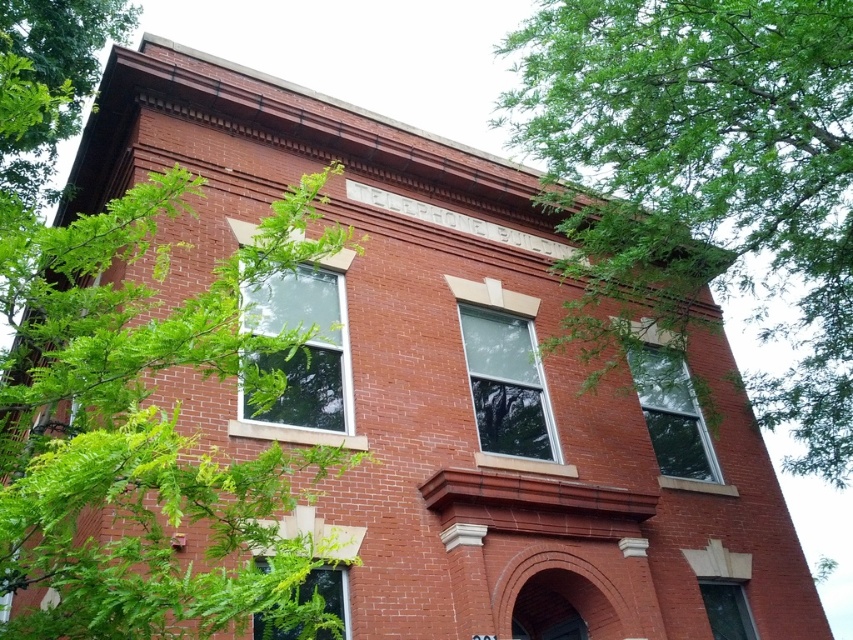
You are standing in front of the ELPHOKE BUILDING. There is a green leafy tree at upper left. Where is the green leafy tree located relative to the building?

The green leafy tree at upper left is located at the upper left corner of the building, at coordinates approximately 0.666 on the x axis and 0.169 on the y axis.